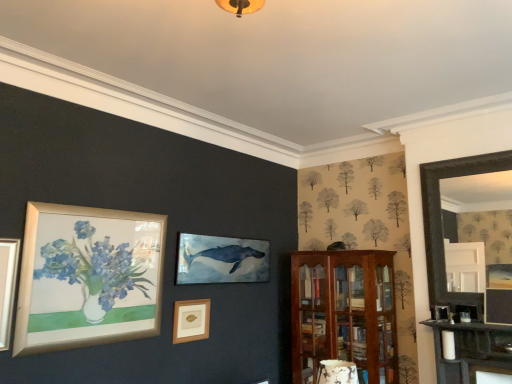
Question: From a real-world perspective, is wooden picture frame at center located higher than black wooden fireplace at right?

Choices:
 (A) no
 (B) yes

Answer: (A)

Question: Does wooden picture frame at center have a smaller size compared to black wooden fireplace at right?

Choices:
 (A) yes
 (B) no

Answer: (A)

Question: From the image's perspective, would you say wooden picture frame at center is positioned over black wooden fireplace at right?

Choices:
 (A) no
 (B) yes

Answer: (A)

Question: Are wooden picture frame at center and black wooden fireplace at right located far from each other?

Choices:
 (A) no
 (B) yes

Answer: (B)

Question: Is wooden picture frame at center at the right side of black wooden fireplace at right?

Choices:
 (A) no
 (B) yes

Answer: (A)

Question: From a real-world perspective, is wooden picture frame at center beneath black wooden fireplace at right?

Choices:
 (A) yes
 (B) no

Answer: (A)

Question: Considering the relative sizes of wooden picture frame at center and mahogany wooden cabinet at right in the image provided, is wooden picture frame at center thinner than mahogany wooden cabinet at right?

Choices:
 (A) yes
 (B) no

Answer: (A)

Question: Considering the relative sizes of wooden picture frame at center and mahogany wooden cabinet at right in the image provided, is wooden picture frame at center taller than mahogany wooden cabinet at right?

Choices:
 (A) yes
 (B) no

Answer: (B)

Question: Are wooden picture frame at center and mahogany wooden cabinet at right far apart?

Choices:
 (A) no
 (B) yes

Answer: (B)

Question: Can you see wooden picture frame at center touching mahogany wooden cabinet at right?

Choices:
 (A) yes
 (B) no

Answer: (B)

Question: Does wooden picture frame at center have a smaller size compared to mahogany wooden cabinet at right?

Choices:
 (A) no
 (B) yes

Answer: (B)

Question: Is wooden picture frame at center positioned with its back to mahogany wooden cabinet at right?

Choices:
 (A) yes
 (B) no

Answer: (B)

Question: Considering the relative sizes of black wooden fireplace at right and wooden picture frame at center in the image provided, is black wooden fireplace at right wider than wooden picture frame at center?

Choices:
 (A) no
 (B) yes

Answer: (B)